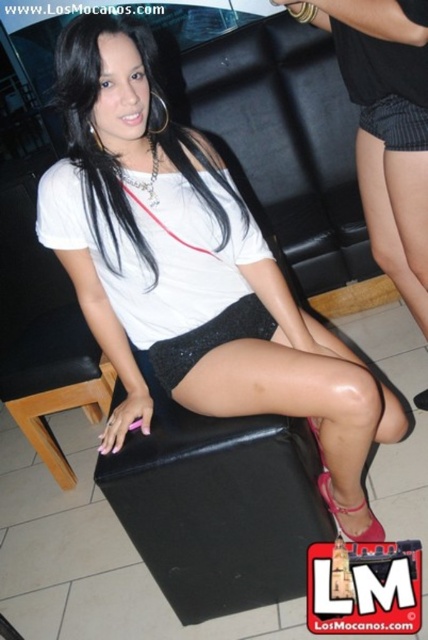
You are standing in the room and want to locate the shiny black shorts at center. According to the coordinates given, where would you find them?

The shiny black shorts at center are located at coordinates point 0.416 on the x axis and 0.439 on the y axis.

You are a fashion designer trying to create a matching outfit for the woman in the image. Given that the black sequined skirt at center is larger than the shiny pink sandal at lower right, which item should you consider adjusting in size to ensure a proportional look?

Since the black sequened skirt at center is bigger than the shiny pink sandal at lower right, you should consider adjusting the size of the shiny pink sandal at lower right to make it larger to match the scale of the skirt.

You are a photographer trying to capture the woman in the image. You want to ensure both the shiny black shorts at center and the black sequined skirt at center are clearly visible in your photo. Which object should you focus on first to ensure both are in frame?

The shiny black shorts at center is positioned on the left side of black sequined skirt at center. To ensure both are in frame, focus on the shiny black shorts at center first as it is closer to the edge, then adjust to include the black sequined skirt at center.